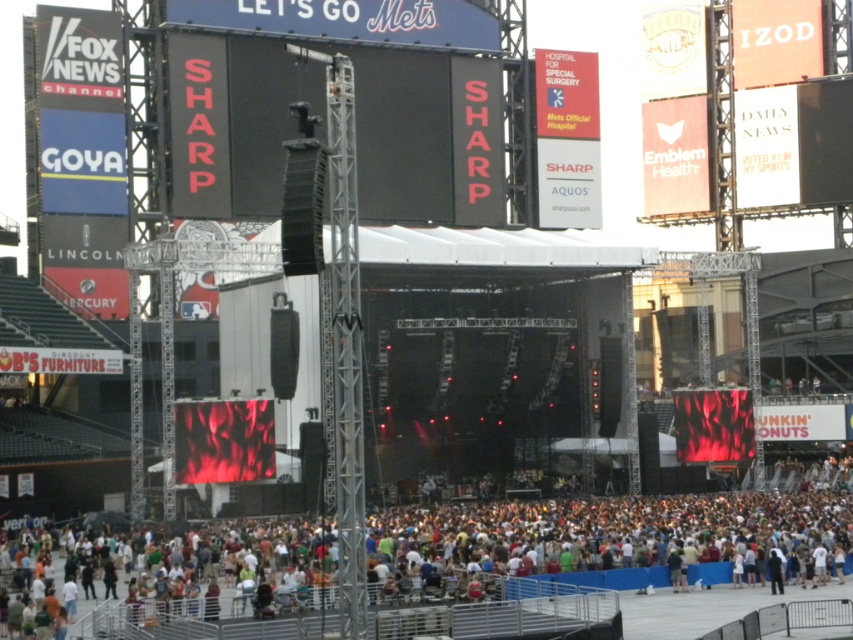
You are a photographer at the Mets concert. You want to take a photo that includes both the multicolored fabric crowd at lower center and the black matte scoreboard at center. Which object should you focus on first to ensure both are in sharp focus?

The multicolored fabric crowd at lower center is closer to the viewer than the black matte scoreboard at center. To ensure both are in sharp focus, focus on the multicolored fabric crowd at lower center first, as it is the closer object.

You are a photographer positioned at the edge of the baseball stadium, aiming to capture the multicolored fabric crowd at lower center. Given that your telephoto lens has a maximum effective range of 200 feet, will you be able to clearly photograph the crowd from your current position?

The multicolored fabric crowd at lower center is 201.80 feet away from the viewer. Since the telephoto lens has a maximum effective range of 200 feet, the crowd is slightly beyond the lens capability, so the photographer cannot clearly photograph the crowd from the current position.

You are a photographer at the concert and want to capture both the stage and the crowd. You have two points marked on your camera screen at coordinates point (155, 612) and point (236, 40). Which point is closer to you, the photographer?

Point (155, 612) is closer to the viewer than point (236, 40).